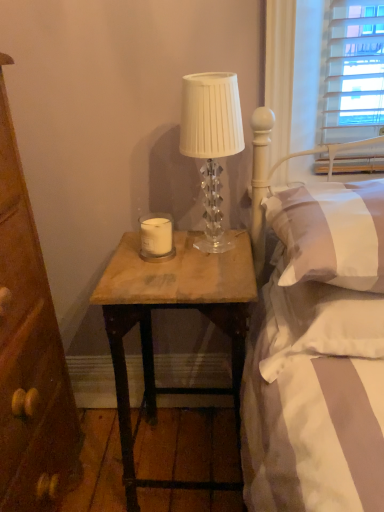
Question: Do you think wooden table at center is within white matte candle at center, or outside of it?

Choices:
 (A) inside
 (B) outside

Answer: (B)

Question: From a real-world perspective, is wooden table at center positioned above or below white matte candle at center?

Choices:
 (A) below
 (B) above

Answer: (A)

Question: Which is nearer to the wooden table at center?

Choices:
 (A) clear crystal lamp at upper center
 (B) brown wood drawer at left
 (C) white matte candle at center
 (D) white soft pillow at right, the 1th pillow positioned from the bottom
 (E) white soft pillow at upper right, which is the 2th pillow from bottom to top

Answer: (D)

Question: Estimate the real-world distances between objects in this image. Which object is closer to the wooden table at center?

Choices:
 (A) white soft pillow at upper right, which is the 2th pillow from bottom to top
 (B) white soft pillow at right, the 2th pillow in the top-to-bottom sequence
 (C) brown wood drawer at left
 (D) clear crystal lamp at upper center
 (E) white matte candle at center

Answer: (B)